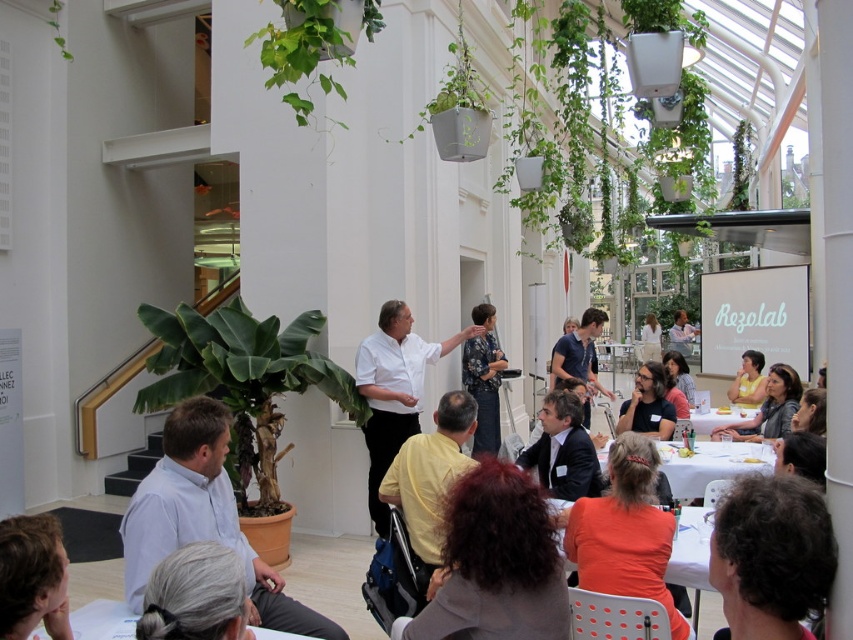
You are organizing a presentation in this room and need to place a projector on the table where the green leafy plant at lower left and the green matte plant at upper center are located. Which plant should you move to make space for the projector?

You should move the green leafy plant at lower left because it is positioned under the green matte plant at upper center, meaning it is closer to the table surface and easier to relocate.